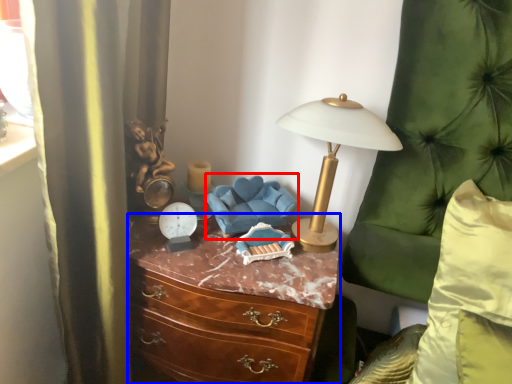
Question: Which point is closer to the camera, swivel chair (highlighted by a red box) or chest of drawers (highlighted by a blue box)?

Choices:
 (A) swivel chair
 (B) chest of drawers

Answer: (B)